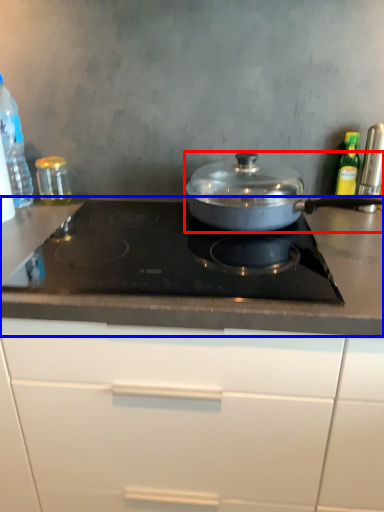
Question: Among these objects, which one is farthest to the camera, kitchen appliance (highlighted by a red box) or countertop (highlighted by a blue box)?

Choices:
 (A) kitchen appliance
 (B) countertop

Answer: (A)